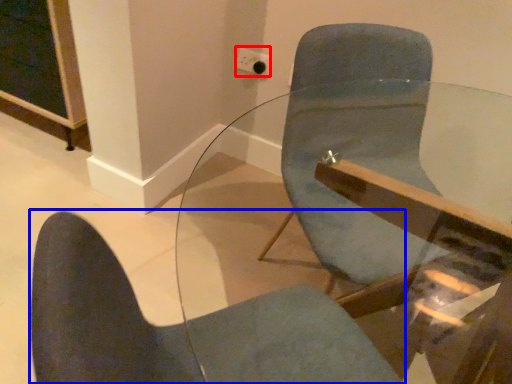
Question: Which of the following is the closest to the observer, electric outlet (highlighted by a red box) or chair (highlighted by a blue box)?

Choices:
 (A) electric outlet
 (B) chair

Answer: (B)